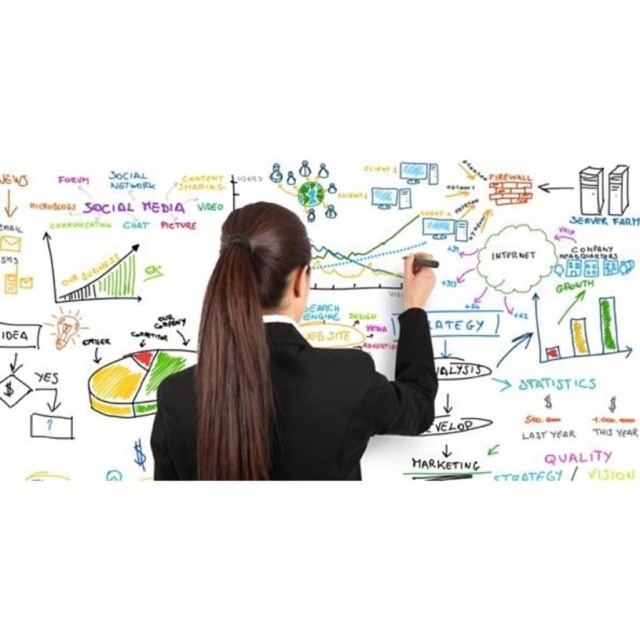
Question: Can you confirm if whiteboard at center is thinner than brown silky hair at center?

Choices:
 (A) no
 (B) yes

Answer: (A)

Question: Which is farther from the brown silky hair at center?

Choices:
 (A) whiteboard at center
 (B) black suit at center

Answer: (A)

Question: Which is farther from the whiteboard at center?

Choices:
 (A) brown silky hair at center
 (B) black suit at center

Answer: (A)

Question: Is whiteboard at center below brown silky hair at center?

Choices:
 (A) yes
 (B) no

Answer: (B)

Question: Considering the real-world distances, which object is closest to the whiteboard at center?

Choices:
 (A) black suit at center
 (B) brown silky hair at center

Answer: (A)

Question: Is whiteboard at center thinner than black suit at center?

Choices:
 (A) no
 (B) yes

Answer: (A)